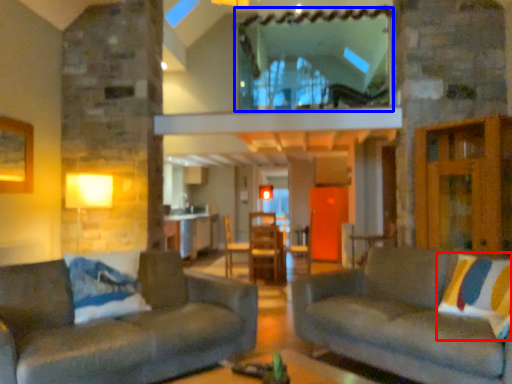
Question: Which of the following is the closest to the observer, pillow (highlighted by a red box) or window (highlighted by a blue box)?

Choices:
 (A) pillow
 (B) window

Answer: (A)